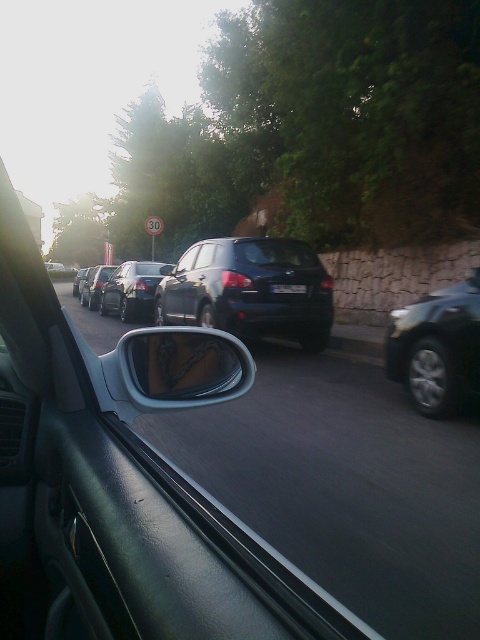
From the picture: Who is lower down, shiny silver sedan at center or black plastic license plate at center?

black plastic license plate at center

Is shiny silver sedan at center taller than black plastic license plate at center?

Yes.

Who is more distant from viewer, (x=92, y=273) or (x=277, y=288)?

Positioned behind is point (x=92, y=273).

Locate an element on the screen. This screenshot has width=480, height=640. shiny silver sedan at center is located at coordinates (94, 285).

Does satin black car at right have a lesser width compared to black plastic license plate at center?

Incorrect, satin black car at right's width is not less than black plastic license plate at center's.

Is satin black car at right above black plastic license plate at center?

No.

Who is more forward, (421, 413) or (276, 291)?

Point (421, 413) is in front.

Locate an element on the screen. Image resolution: width=480 pixels, height=640 pixels. satin black car at right is located at coordinates (436, 348).

Does matte black hatchback at center come behind satin black car at right?

Yes, it is behind satin black car at right.

Who is more forward, (222, 314) or (431, 358)?

Point (431, 358)

Locate an element on the screen. matte black hatchback at center is located at coordinates (249, 291).